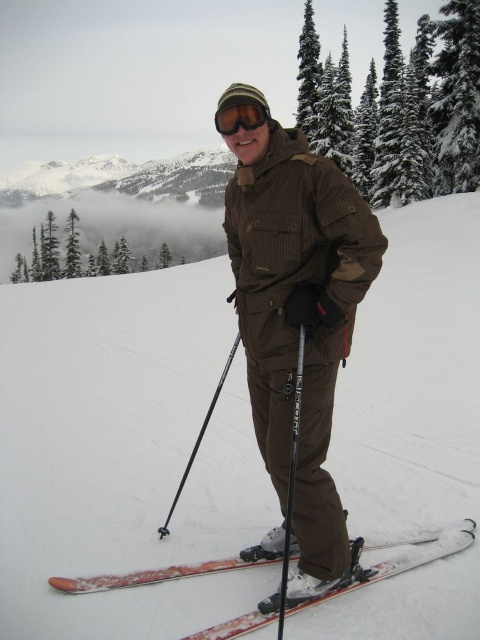
Can you confirm if white powder snow at center is wider than matte black goggles at center?

Indeed, white powder snow at center has a greater width compared to matte black goggles at center.

Where is `white powder snow at center`? Image resolution: width=480 pixels, height=640 pixels. white powder snow at center is located at coordinates (124, 452).

Based on the photo, can you confirm if silver metallic ski pole at center is positioned above matte black goggles at center?

Incorrect, silver metallic ski pole at center is not positioned above matte black goggles at center.

Which is behind, point (301, 368) or point (250, 120)?

The point (250, 120) is more distant.

The height and width of the screenshot is (640, 480). Describe the element at coordinates (290, 481) in the screenshot. I see `silver metallic ski pole at center` at that location.

Image resolution: width=480 pixels, height=640 pixels. Identify the location of silver metallic ski pole at center. (290, 481).

Does white powder snow at center have a greater width compared to black matte ski pole at center?

Yes.

Measure the distance between white powder snow at center and black matte ski pole at center.

A distance of 21.51 meters exists between white powder snow at center and black matte ski pole at center.

Measure the distance between point [153,604] and camera.

They are 16.45 feet apart.

Where is `white powder snow at center`? This screenshot has height=640, width=480. white powder snow at center is located at coordinates click(x=124, y=452).